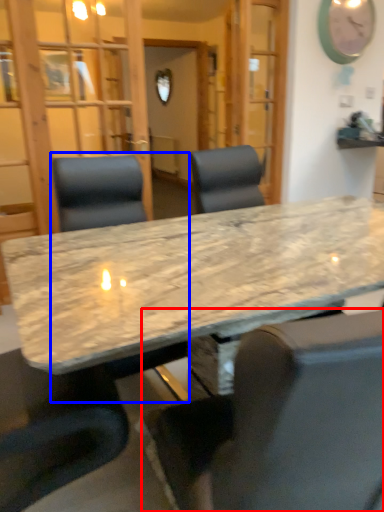
Question: Which of the following is the closest to the observer, chair (highlighted by a red box) or chair (highlighted by a blue box)?

Choices:
 (A) chair
 (B) chair

Answer: (A)